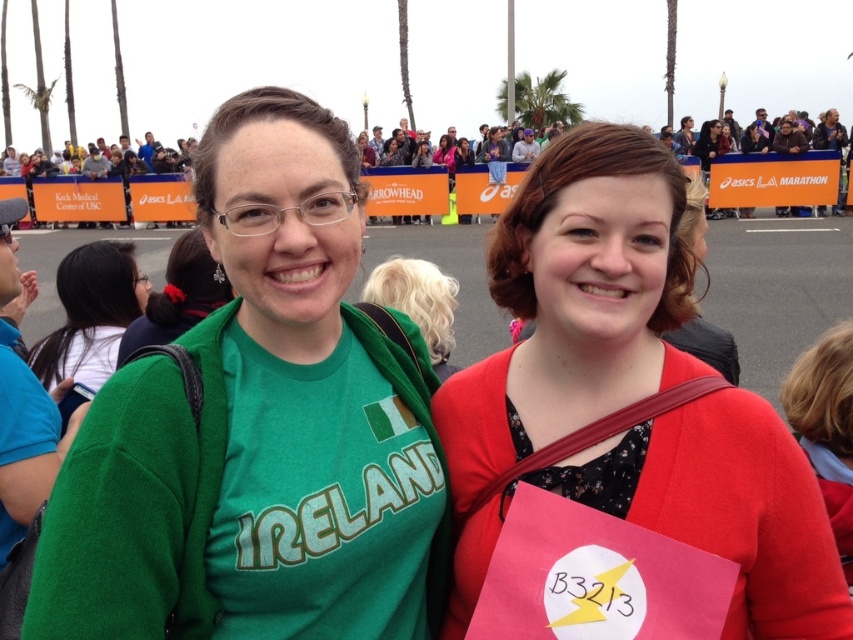
Locate an element on the screen. Image resolution: width=853 pixels, height=640 pixels. green cotton shirt at center is located at coordinates (259, 429).

Can you confirm if green cotton shirt at center is positioned above green fabric at center?

No, green cotton shirt at center is not above green fabric at center.

This screenshot has height=640, width=853. I want to click on green cotton shirt at center, so click(x=259, y=429).

This screenshot has height=640, width=853. Find the location of `green cotton shirt at center`. green cotton shirt at center is located at coordinates (259, 429).

Does green cotton shirt at center have a larger size compared to matte red cardigan at center?

Yes.

Is point (416, 614) farther from viewer compared to point (717, 426)?

Yes, it is behind point (717, 426).

What are the coordinates of `green cotton shirt at center` in the screenshot? It's located at (259, 429).

Can you confirm if matte red cardigan at center is wider than green fabric shirt at center?

Yes.

Which is more to the left, matte red cardigan at center or green fabric shirt at center?

Positioned to the left is green fabric shirt at center.

Is point (509, 252) in front of point (99, 387)?

Yes, it is in front of point (99, 387).

This screenshot has height=640, width=853. I want to click on matte red cardigan at center, so [627, 396].